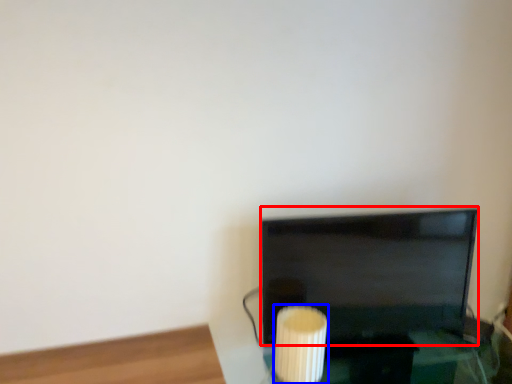
Question: Which object appears closest to the camera in this image, television (highlighted by a red box) or candle holder (highlighted by a blue box)?

Choices:
 (A) television
 (B) candle holder

Answer: (B)